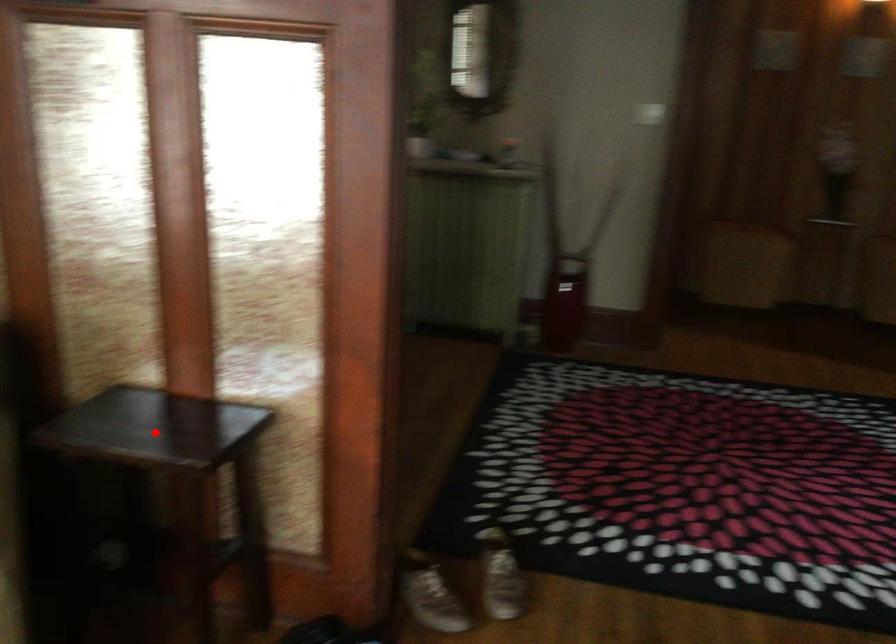
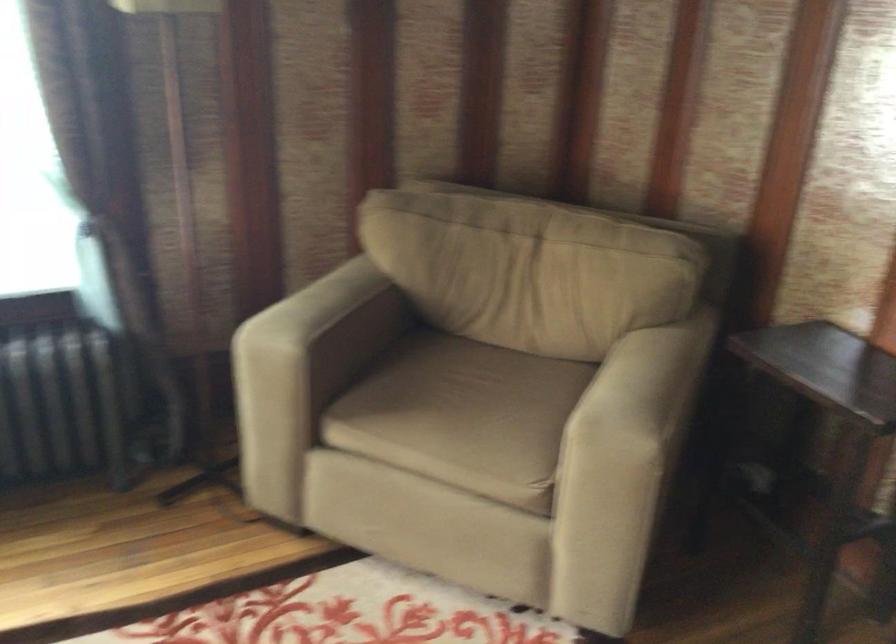
In the second image, find the point that corresponds to the highlighted location in the first image.

(826, 368)